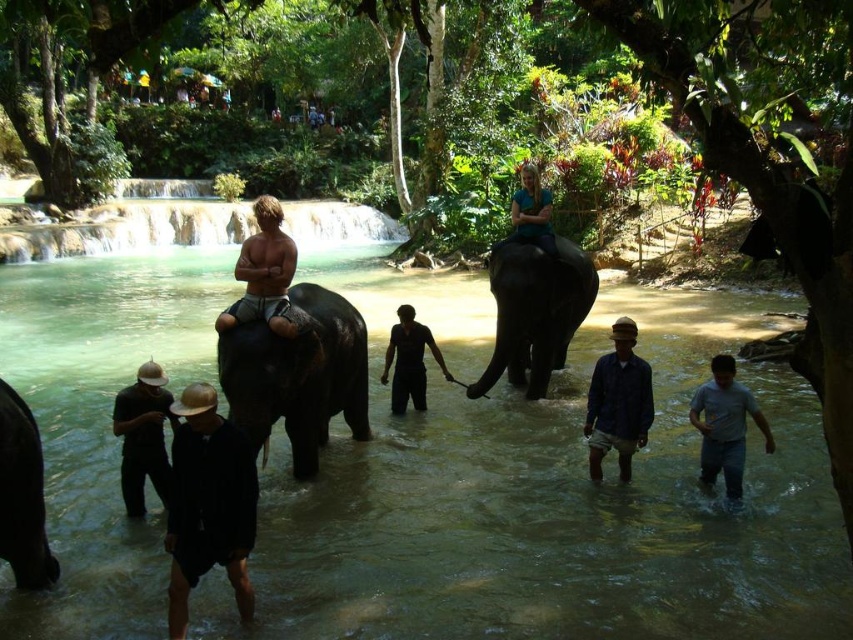
You are standing at the camera position observing the scene. There is a brown cotton shirt at lower center. If you want to take a photo of it, will you need a telephoto lens to capture it clearly?

The brown cotton shirt at lower center is 49.11 feet away from the camera. Since telephoto lenses are used for distant subjects, you would need one to capture it clearly from this distance.

You are a photographer standing at the edge of the waterfall in the background. You want to take a photo that includes both the gray cotton shirt at lower right and the light brown skin at center. Given their distance apart, is it possible to capture both in a single frame without moving your position?

The gray cotton shirt at lower right and light brown skin at center are 9.13 meters apart from each other. Since most cameras have a wide enough angle to capture objects 9.13 meters apart when positioned centrally, it should be possible to include both in a single frame without moving.